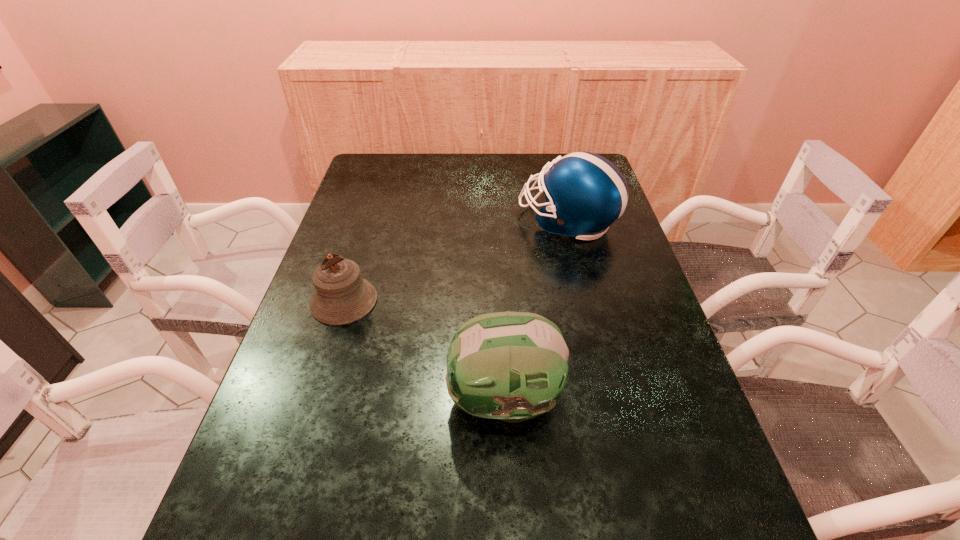
The image size is (960, 540). I want to click on free space located on the right of the leftmost object, so click(x=478, y=301).

Find the location of a particular element. The width and height of the screenshot is (960, 540). object present at the left edge is located at coordinates [x=342, y=296].

Locate an element on the screen. Image resolution: width=960 pixels, height=540 pixels. object located at the right edge is located at coordinates (585, 193).

Find the location of a particular element. The width and height of the screenshot is (960, 540). vacant space at the far edge is located at coordinates (462, 159).

Find the location of a particular element. This screenshot has height=540, width=960. vacant space at the left edge of the desktop is located at coordinates (312, 455).

In the image, there is a desktop. At what (x,y) coordinates should I click in order to perform the action: click on vacant space at the right edge. Please return your answer as a coordinate pair (x, y). The width and height of the screenshot is (960, 540). Looking at the image, I should click on pos(650,425).

The image size is (960, 540). In order to click on free space at the far left corner of the desktop in this screenshot , I will do `click(396, 166)`.

This screenshot has height=540, width=960. Identify the location of free area in between the farther football helmet and the nearer football helmet. (536, 310).

Locate an element on the screen. This screenshot has height=540, width=960. vacant region between the nearest object and the farthest object is located at coordinates (536, 310).

This screenshot has width=960, height=540. I want to click on free point between the farthest object and the bell, so click(456, 261).